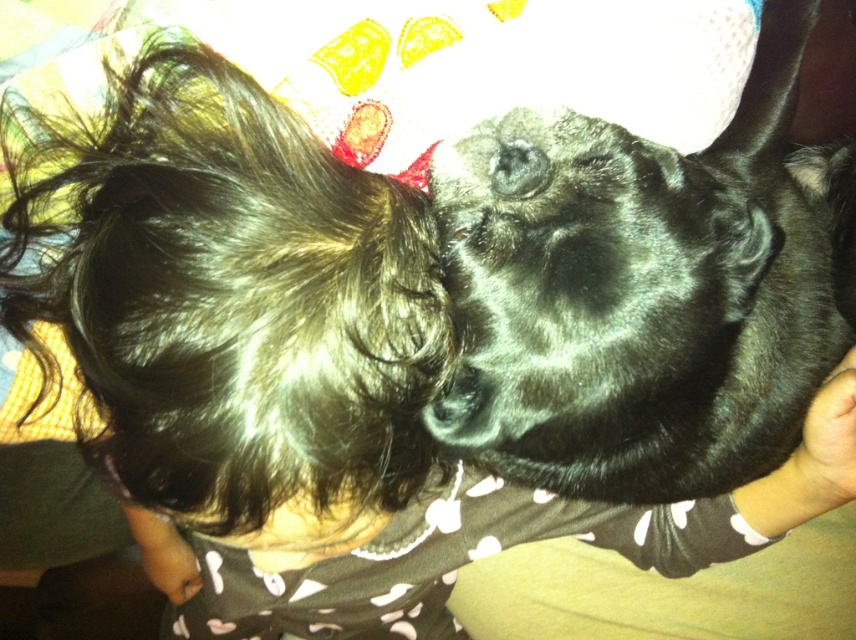
Question: Can you confirm if shiny dark brown hair at upper left is positioned above black fur dog at center?

Choices:
 (A) no
 (B) yes

Answer: (A)

Question: Which object appears farthest from the camera in this image?

Choices:
 (A) black fur dog at center
 (B) black fur nose at center

Answer: (B)

Question: Which point is closer to the camera?

Choices:
 (A) (324, 164)
 (B) (817, 189)

Answer: (A)

Question: Is the position of shiny dark brown hair at upper left less distant than that of black fur nose at center?

Choices:
 (A) no
 (B) yes

Answer: (B)

Question: Is shiny dark brown hair at upper left above black fur dog at center?

Choices:
 (A) yes
 (B) no

Answer: (B)

Question: Which point appears closest to the camera in this image?

Choices:
 (A) (771, 264)
 (B) (473, 406)

Answer: (B)